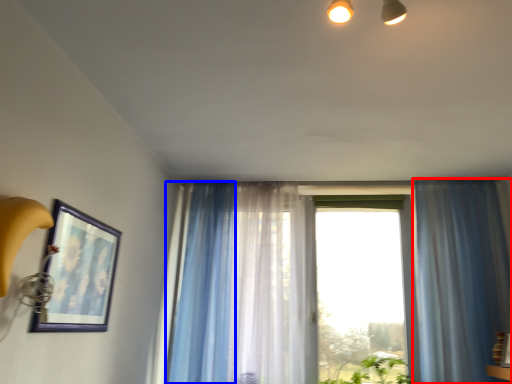
Question: Which of the following is the farthest to the observer, curtain (highlighted by a red box) or curtain (highlighted by a blue box)?

Choices:
 (A) curtain
 (B) curtain

Answer: (B)